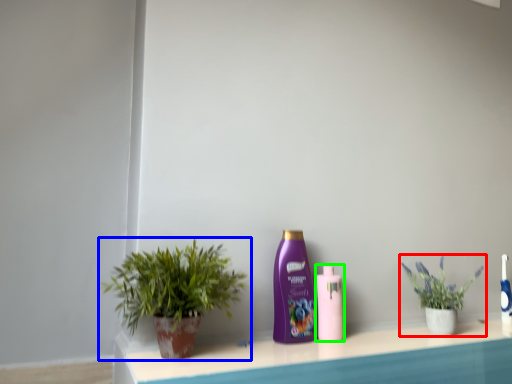
Question: Which object is the farthest from houseplant (highlighted by a red box)? Choose among these: houseplant (highlighted by a blue box) or bottle (highlighted by a green box).

Choices:
 (A) houseplant
 (B) bottle

Answer: (A)